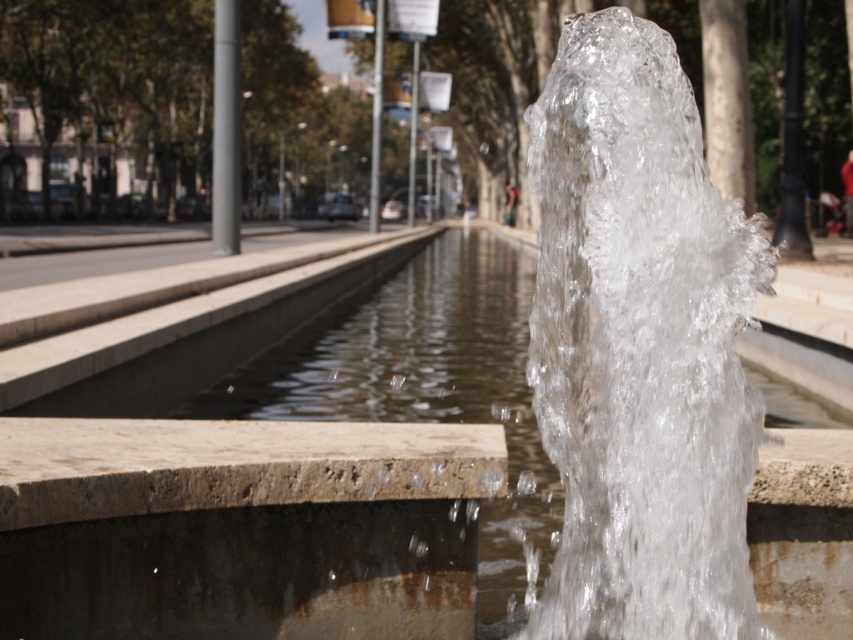
You are a maintenance worker inspecting the fountain. You notice two areas of clear water at the center of the fountain. One is labeled as clear liquid water at center and the other as clear water at center. According to the description, which one is positioned lower?

The clear liquid water at center is positioned below the clear water at center.

You are a maintenance worker checking the water levels in the fountain. You notice two areas of water, the clear liquid water at center and the clear water at center. Which one has a smaller size?

The clear liquid water at center has a smaller size compared to the clear water at center.

You are standing in front of the fountain and want to reach the clear water at center. However, there is an obstacle between you and the clear liquid water at center. Which object is blocking your path?

The clear liquid water at center is closer to the viewer than the clear water at center, so the clear water at center is blocking the path to the clear liquid water at center.